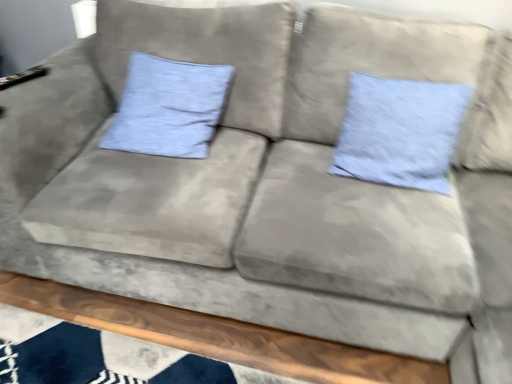
Question: Is point (210, 122) closer or farther from the camera than point (352, 129)?

Choices:
 (A) farther
 (B) closer

Answer: (A)

Question: Based on their positions, is light blue fabric pillow at upper left, the 2th pillow when ordered from right to left, located to the left or right of light blue fabric pillow at center, the second pillow when ordered from left to right?

Choices:
 (A) left
 (B) right

Answer: (A)

Question: Considering the positions of light blue fabric pillow at upper left, the 2th pillow when ordered from right to left, and light blue fabric pillow at center, which ranks as the 1th pillow in right-to-left order, in the image, is light blue fabric pillow at upper left, the 2th pillow when ordered from right to left, bigger or smaller than light blue fabric pillow at center, which ranks as the 1th pillow in right-to-left order,?

Choices:
 (A) small
 (B) big

Answer: (B)

Question: From a real-world perspective, is light blue fabric pillow at center, the second pillow when ordered from left to right, above or below light blue fabric pillow at upper left, placed as the 1th pillow when sorted from left to right?

Choices:
 (A) above
 (B) below

Answer: (A)

Question: From the image's perspective, relative to light blue fabric pillow at upper left, placed as the 1th pillow when sorted from left to right, is light blue fabric pillow at center, which ranks as the 1th pillow in right-to-left order, above or below?

Choices:
 (A) above
 (B) below

Answer: (B)

Question: Is light blue fabric pillow at center, the second pillow when ordered from left to right, wider or thinner than light blue fabric pillow at upper left, placed as the 1th pillow when sorted from left to right?

Choices:
 (A) thin
 (B) wide

Answer: (A)

Question: Looking at the image, does light blue fabric pillow at center, the second pillow when ordered from left to right, seem bigger or smaller compared to light blue fabric pillow at upper left, placed as the 1th pillow when sorted from left to right?

Choices:
 (A) big
 (B) small

Answer: (B)